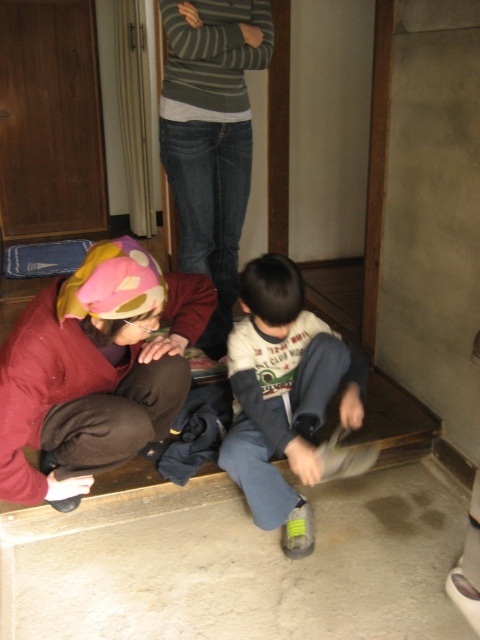
Question: Which point is farther from the camera taking this photo?

Choices:
 (A) (181, 20)
 (B) (52, 440)

Answer: (A)

Question: Which object is positioned closest to the white cotton shirt at center?

Choices:
 (A) striped sweater at center
 (B) brown fabric at lower left

Answer: (B)

Question: Does brown fabric at lower left appear on the left side of striped sweater at center?

Choices:
 (A) no
 (B) yes

Answer: (B)

Question: Is brown fabric at lower left positioned at the back of white cotton shirt at center?

Choices:
 (A) yes
 (B) no

Answer: (B)

Question: Which of these objects is positioned farthest from the white cotton shirt at center?

Choices:
 (A) brown fabric at lower left
 (B) striped sweater at center

Answer: (B)

Question: Can you confirm if striped sweater at center is thinner than white cotton shirt at center?

Choices:
 (A) no
 (B) yes

Answer: (B)